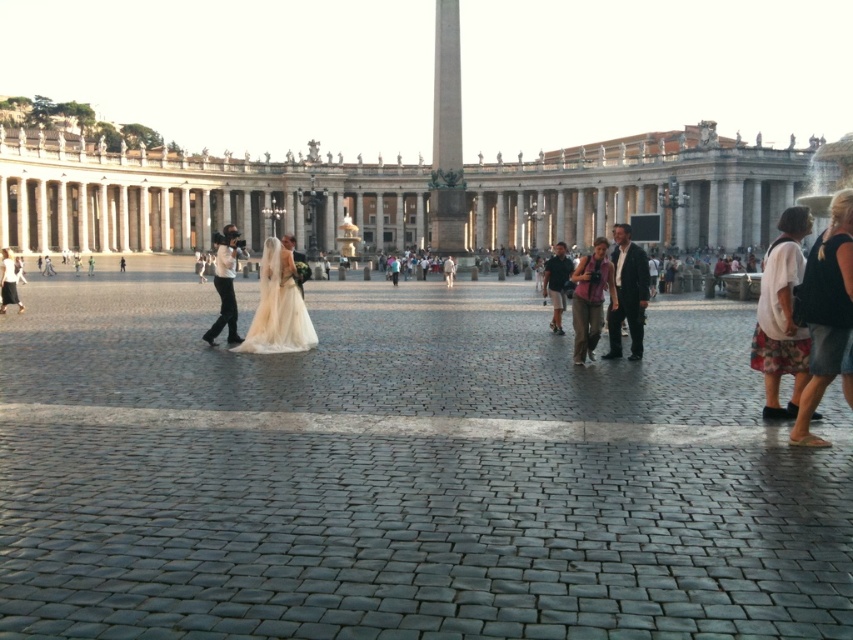
In the scene shown: Between pink fabric purse at center and white cotton shirt at center, which one has more height?

white cotton shirt at center is taller.

Does pink fabric purse at center have a lesser height compared to white cotton shirt at center?

Correct, pink fabric purse at center is not as tall as white cotton shirt at center.

Image resolution: width=853 pixels, height=640 pixels. Describe the element at coordinates (590, 298) in the screenshot. I see `pink fabric purse at center` at that location.

This screenshot has height=640, width=853. What are the coordinates of `pink fabric purse at center` in the screenshot? It's located at (590, 298).

Between point (817, 372) and point (608, 314), which one is positioned behind?

The point (608, 314) is more distant.

Does denim skirt at right have a larger size compared to dark gray suit at center?

Incorrect, denim skirt at right is not larger than dark gray suit at center.

What do you see at coordinates (825, 310) in the screenshot? I see `denim skirt at right` at bounding box center [825, 310].

Find the location of a particular element. The image size is (853, 640). denim skirt at right is located at coordinates (825, 310).

Who is positioned more to the right, pink fabric purse at center or white cotton dress at lower left?

From the viewer's perspective, pink fabric purse at center appears more on the right side.

Is point (614, 292) closer to camera compared to point (4, 278)?

That is True.

You are a GUI agent. You are given a task and a screenshot of the screen. Output one action in this format:
    pyautogui.click(x=<x>, y=<y>)
    Task: Click on the pink fabric purse at center
    This screenshot has height=640, width=853.
    Given the screenshot: What is the action you would take?
    pyautogui.click(x=590, y=298)